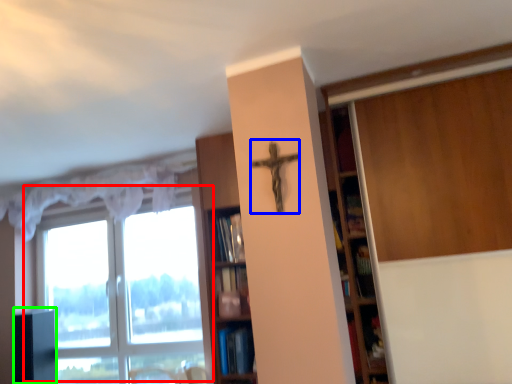
Question: Based on their relative distances, which object is farther from window (highlighted by a red box)? Choose from crucifix (highlighted by a blue box) and cabinetry (highlighted by a green box).

Choices:
 (A) crucifix
 (B) cabinetry

Answer: (A)